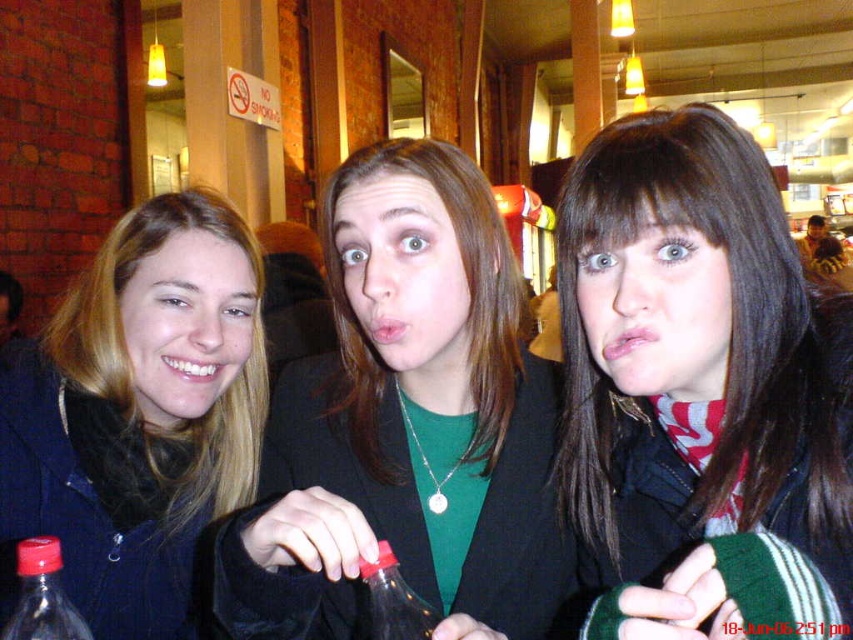
Is dark brown hair at center positioned behind translucent plastic bottle at lower left?

No, it is not.

Who is more distant from viewer, (654, 628) or (28, 557)?

Positioned behind is point (28, 557).

Where is `dark brown hair at center`? Image resolution: width=853 pixels, height=640 pixels. dark brown hair at center is located at coordinates (700, 392).

Who is shorter, green matte shirt at center or transparent plastic bottle at center?

transparent plastic bottle at center

Is green matte shirt at center above transparent plastic bottle at center?

Yes, green matte shirt at center is above transparent plastic bottle at center.

Between point (380, 275) and point (419, 628), which one is positioned behind?

Point (380, 275)

At what (x,y) coordinates should I click in order to perform the action: click on green matte shirt at center. Please return your answer as a coordinate pair (x, y). Image resolution: width=853 pixels, height=640 pixels. Looking at the image, I should click on (405, 422).

Is point (738, 248) closer to viewer compared to point (381, 604)?

No, (738, 248) is behind (381, 604).

This screenshot has height=640, width=853. What do you see at coordinates (700, 392) in the screenshot? I see `dark brown hair at center` at bounding box center [700, 392].

At what (x,y) coordinates should I click in order to perform the action: click on dark brown hair at center. Please return your answer as a coordinate pair (x, y). The width and height of the screenshot is (853, 640). Looking at the image, I should click on (700, 392).